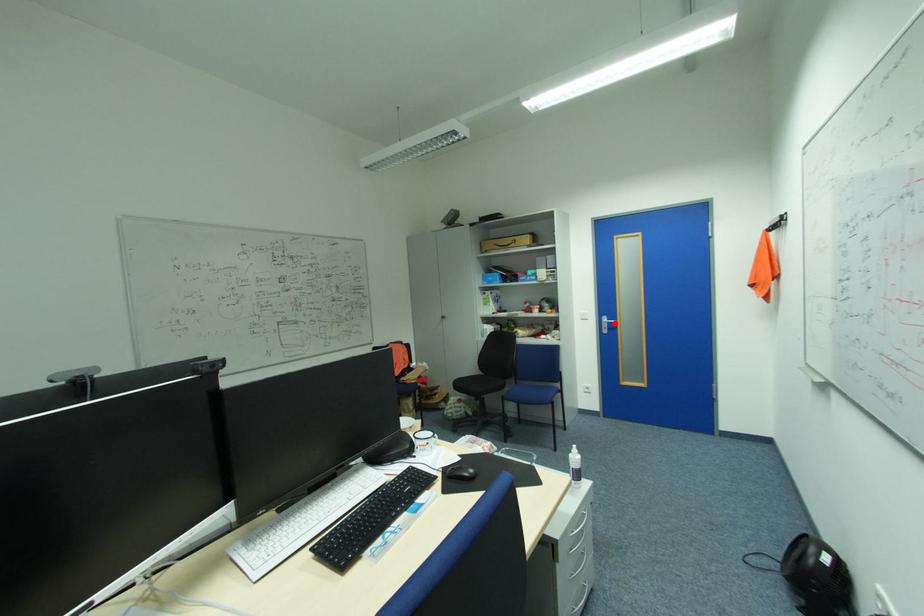
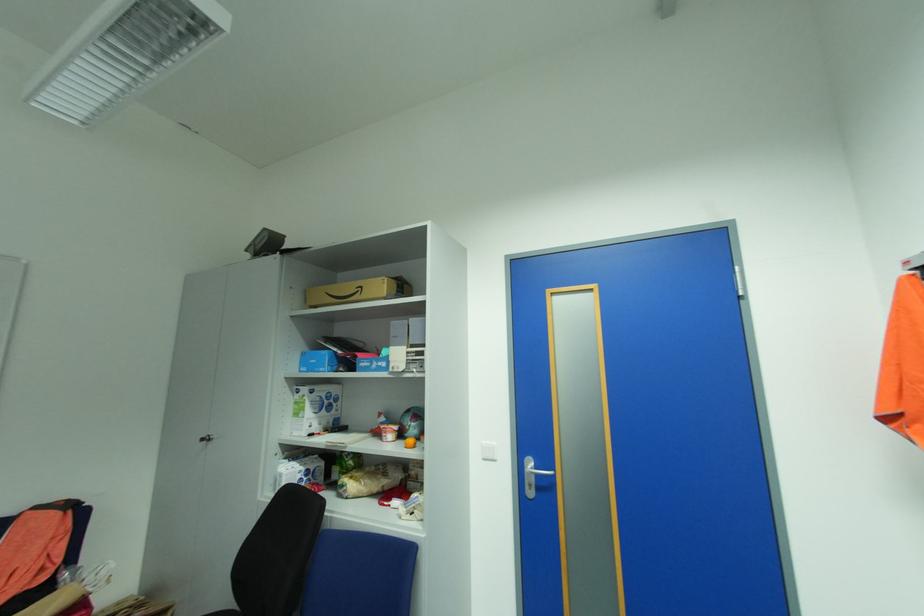
In the second image, find the point that corresponds to the highlighted location in the first image.

(543, 475)